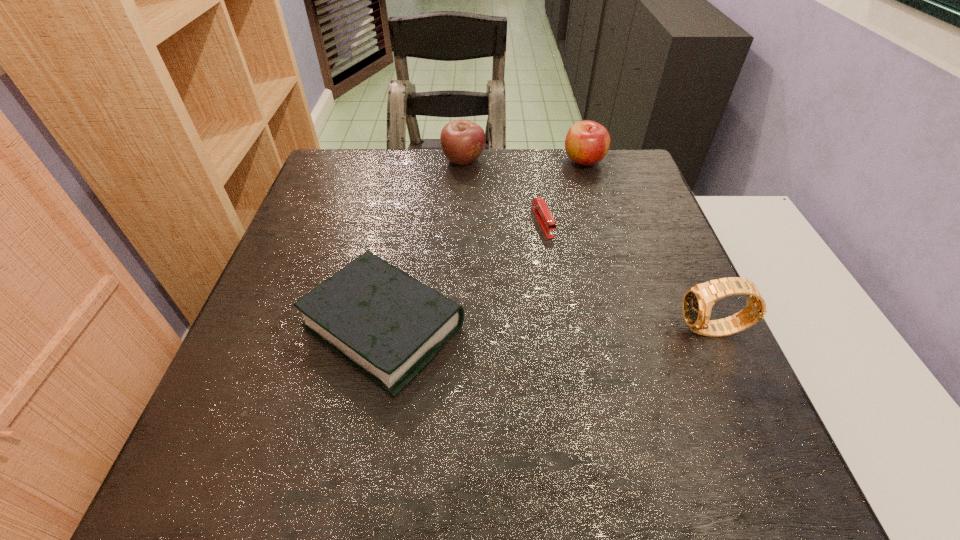
Find the location of a particular element. The width and height of the screenshot is (960, 540). vacant space located 0.200m on the side of the left apple with the unique marking is located at coordinates (492, 214).

At what (x,y) coordinates should I click in order to perform the action: click on blank space located 0.290m on the side of the left apple with the unique marking. Please return your answer as a coordinate pair (x, y). The image size is (960, 540). Looking at the image, I should click on (504, 236).

The height and width of the screenshot is (540, 960). Identify the location of vacant space situated 0.290m on the side of the left apple with the unique marking. (504, 236).

Where is `vacant point located on the front-facing side of the third object from right to left`? Image resolution: width=960 pixels, height=540 pixels. vacant point located on the front-facing side of the third object from right to left is located at coordinates (587, 320).

The height and width of the screenshot is (540, 960). In order to click on blank space located 0.380m on the front-facing side of the third object from right to left in this screenshot , I will do `click(614, 376)`.

In order to click on vacant point located on the front-facing side of the third object from right to left in this screenshot , I will do click(x=616, y=381).

Where is `free space located on the stem of the right apple`? This screenshot has height=540, width=960. free space located on the stem of the right apple is located at coordinates (589, 239).

Locate an element on the screen. This screenshot has width=960, height=540. free space located 0.230m on the stem of the right apple is located at coordinates (588, 225).

At what (x,y) coordinates should I click in order to perform the action: click on vacant area located 0.390m on the stem of the right apple. Please return your answer as a coordinate pair (x, y). This screenshot has width=960, height=540. Looking at the image, I should click on (592, 271).

At what (x,y) coordinates should I click in order to perform the action: click on object located at the near edge. Please return your answer as a coordinate pair (x, y). This screenshot has width=960, height=540. Looking at the image, I should click on (390, 326).